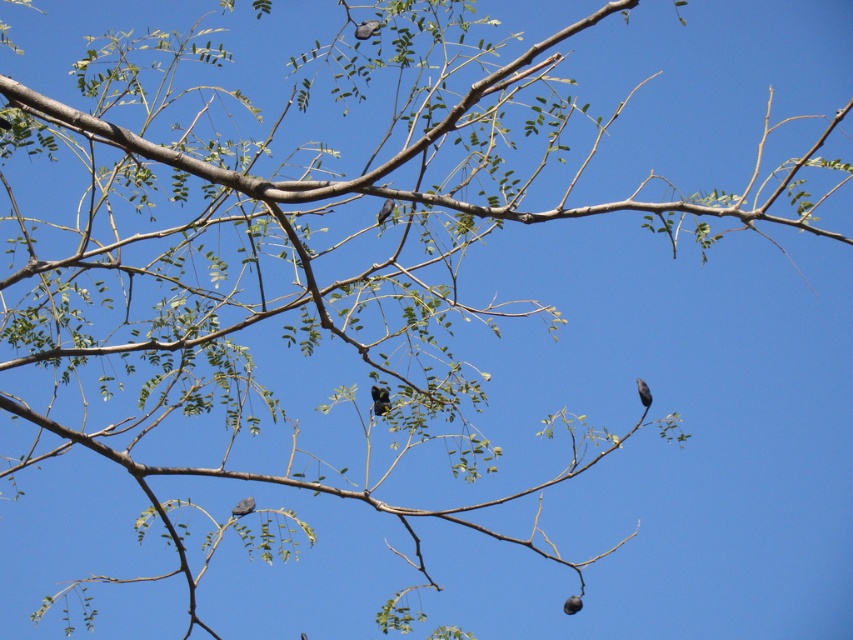
Is silvery metallic bird at center to the right of brown matte bird at center from the viewer's perspective?

In fact, silvery metallic bird at center is to the left of brown matte bird at center.

Image resolution: width=853 pixels, height=640 pixels. Describe the element at coordinates (379, 400) in the screenshot. I see `silvery metallic bird at center` at that location.

I want to click on silvery metallic bird at center, so (x=379, y=400).

Does silvery metallic bird at center appear on the right side of gray matte bird at right?

In fact, silvery metallic bird at center is to the left of gray matte bird at right.

What do you see at coordinates (379, 400) in the screenshot? This screenshot has height=640, width=853. I see `silvery metallic bird at center` at bounding box center [379, 400].

Locate an element on the screen. The height and width of the screenshot is (640, 853). silvery metallic bird at center is located at coordinates (379, 400).

Can you confirm if silvery metallic bird at center is shorter than gray matte bird at center?

No, silvery metallic bird at center is not shorter than gray matte bird at center.

Is silvery metallic bird at center further to camera compared to gray matte bird at center?

Yes, silvery metallic bird at center is further from the viewer.

Which is in front, point (383, 392) or point (236, 508)?

Point (236, 508)

The image size is (853, 640). Find the location of `silvery metallic bird at center`. silvery metallic bird at center is located at coordinates (379, 400).